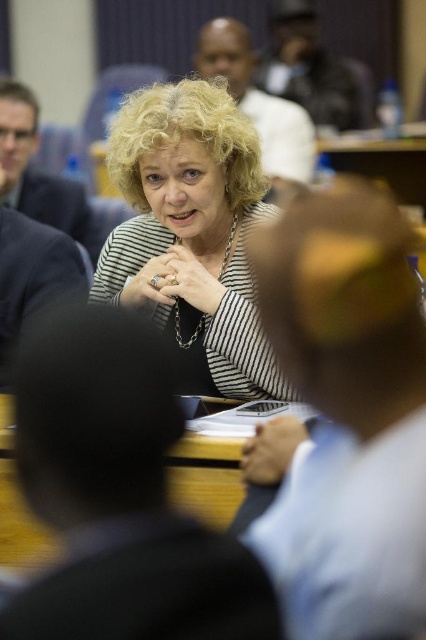
Looking at this image, between striped fabric woman at center and wooden table at center, which one has less height?

wooden table at center is shorter.

Does striped fabric woman at center appear on the right side of wooden table at center?

No, striped fabric woman at center is not to the right of wooden table at center.

Where is `striped fabric woman at center`? This screenshot has width=426, height=640. striped fabric woman at center is located at coordinates (190, 227).